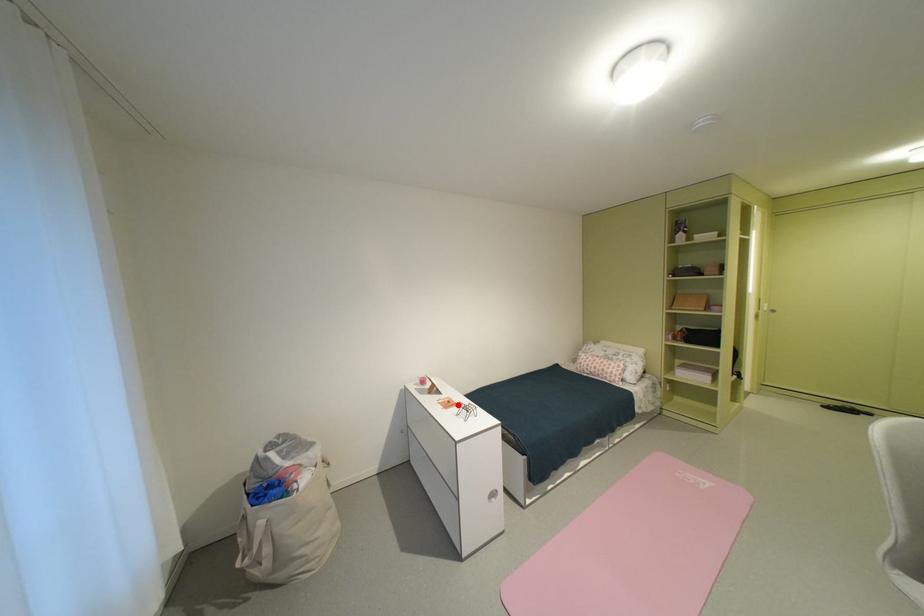
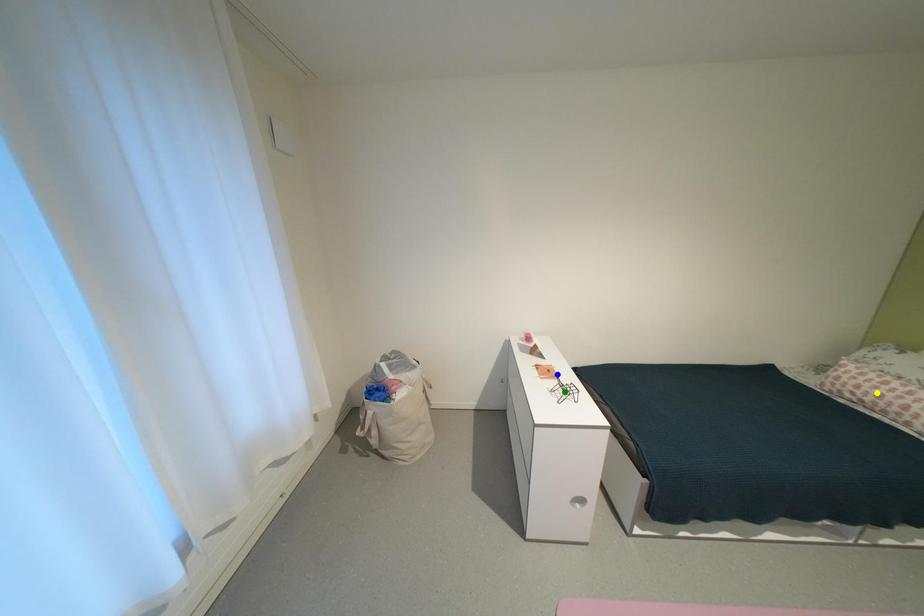
Question: I am providing you with two images of the same scene from different viewpoints. A red point is marked on the first image. You are given multiple points on the second image. Which mark in image 2 goes with the point in image 1?

Choices:
 (A) yellow point
 (B) blue point
 (C) green point

Answer: (B)